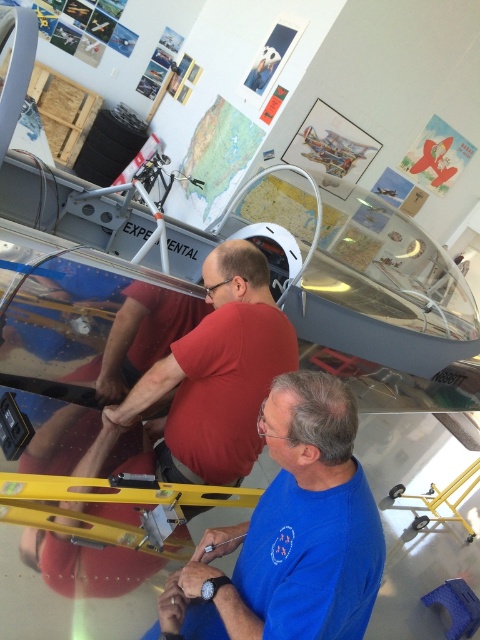
Question: Does blue fabric shirt at lower center appear on the left side of matte red shirt at center?

Choices:
 (A) yes
 (B) no

Answer: (B)

Question: Does blue fabric shirt at lower center have a smaller size compared to matte red shirt at center?

Choices:
 (A) no
 (B) yes

Answer: (B)

Question: Among these points, which one is nearest to the camera?

Choices:
 (A) (224, 440)
 (B) (273, 621)

Answer: (B)

Question: Among these points, which one is farthest from the camera?

Choices:
 (A) (265, 278)
 (B) (310, 429)

Answer: (A)

Question: Considering the relative positions of blue fabric shirt at lower center and matte red shirt at center in the image provided, where is blue fabric shirt at lower center located with respect to matte red shirt at center?

Choices:
 (A) right
 (B) left

Answer: (A)